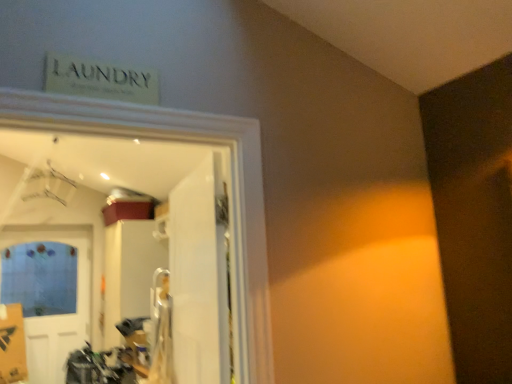
Question: From their relative heights in the image, would you say white glossy door at center, positioned as the first door in right-to-left order, is taller or shorter than blue matte door at lower left, which is the 1th door in back-to-front order?

Choices:
 (A) short
 (B) tall

Answer: (A)

Question: Looking at their shapes, would you say white glossy door at center, which is the first door in front-to-back order, is wider or thinner than blue matte door at lower left, which is the 1th door in back-to-front order?

Choices:
 (A) thin
 (B) wide

Answer: (B)

Question: From the image's perspective, is white glossy door at center, which is the first door in front-to-back order, above or below blue matte door at lower left, the first door in the left-to-right sequence?

Choices:
 (A) below
 (B) above

Answer: (B)

Question: From their relative heights in the image, would you say blue matte door at lower left, which is the 1th door in back-to-front order, is taller or shorter than white glossy door at center, positioned as the first door in right-to-left order?

Choices:
 (A) short
 (B) tall

Answer: (B)

Question: From the image's perspective, is blue matte door at lower left, which is the 2th door from right to left, above or below white glossy door at center, which is the second door in back-to-front order?

Choices:
 (A) below
 (B) above

Answer: (A)

Question: Considering the positions of point (40, 235) and point (192, 182), is point (40, 235) closer or farther from the camera than point (192, 182)?

Choices:
 (A) farther
 (B) closer

Answer: (A)

Question: Do you think blue matte door at lower left, which ranks as the second door in front-to-back order, is within white glossy door at center, which is the first door in front-to-back order, or outside of it?

Choices:
 (A) inside
 (B) outside

Answer: (B)